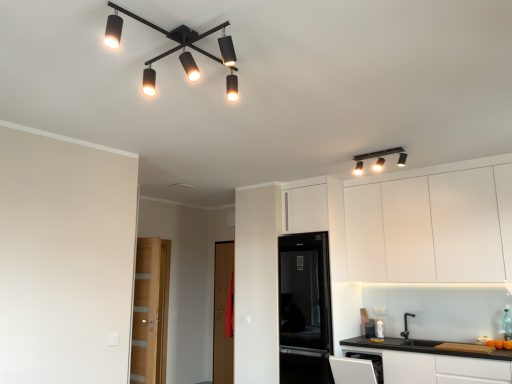
Where is `white matte cabinet at lower right, arranged as the 1th cabinetry when ordered from the bottom`? This screenshot has height=384, width=512. white matte cabinet at lower right, arranged as the 1th cabinetry when ordered from the bottom is located at coordinates (434, 361).

What do you see at coordinates (434, 361) in the screenshot? I see `white matte cabinet at lower right, the 2th cabinetry from the top` at bounding box center [434, 361].

Where is `black glass refrigerator at center`? black glass refrigerator at center is located at coordinates (305, 309).

What do you see at coordinates (182, 46) in the screenshot? I see `matte black light fixture at upper left` at bounding box center [182, 46].

Identify the location of brown wooden door at center. (222, 313).

Does point (225, 246) come closer to viewer compared to point (293, 236)?

No.

From a real-world perspective, is brown wooden door at center above or below black glass refrigerator at center?

In terms of real-world spatial position, brown wooden door at center is below black glass refrigerator at center.

From the image's perspective, which one is positioned lower, brown wooden door at center or black glass refrigerator at center?

brown wooden door at center, from the image's perspective.

Is brown wooden door at center bigger or smaller than black glass refrigerator at center?

In the image, brown wooden door at center appears to be smaller than black glass refrigerator at center.

Considering the relative positions of black glass refrigerator at center and matte black light fixture at upper left in the image provided, is black glass refrigerator at center to the right of matte black light fixture at upper left from the viewer's perspective?

Yes, black glass refrigerator at center is to the right of matte black light fixture at upper left.

Does black glass refrigerator at center have a smaller size compared to matte black light fixture at upper left?

No, black glass refrigerator at center is not smaller than matte black light fixture at upper left.

Does black glass refrigerator at center contain matte black light fixture at upper left?

No.

Based on the photo, is black glass refrigerator at center facing towards matte black light fixture at upper left?

No.

In terms of width, does light brown wooden door at left look wider or thinner when compared to matte black light fixture at upper right?

Considering their sizes, light brown wooden door at left looks broader than matte black light fixture at upper right.

Can matte black light fixture at upper right be found inside light brown wooden door at left?

That's incorrect, matte black light fixture at upper right is not inside light brown wooden door at left.

How distant is light brown wooden door at left from matte black light fixture at upper right?

They are 2.77 meters apart.

Is light brown wooden door at left looking in the opposite direction of matte black light fixture at upper right?

No, light brown wooden door at left's orientation is not away from matte black light fixture at upper right.

Is light brown wooden door at left closer to camera compared to white matte cabinet at upper right, which ranks as the first cabinetry in top-to-bottom order?

No, light brown wooden door at left is behind white matte cabinet at upper right, which ranks as the first cabinetry in top-to-bottom order.

Can you confirm if light brown wooden door at left is bigger than white matte cabinet at upper right, the 2th cabinetry when ordered from bottom to top?

Actually, light brown wooden door at left might be smaller than white matte cabinet at upper right, the 2th cabinetry when ordered from bottom to top.

Is light brown wooden door at left oriented away from white matte cabinet at upper right, which ranks as the first cabinetry in top-to-bottom order?

No, light brown wooden door at left is not facing away from white matte cabinet at upper right, which ranks as the first cabinetry in top-to-bottom order.

Is brown wooden door at center in contact with white matte cabinet at lower right, the 2th cabinetry from the top?

There is a gap between brown wooden door at center and white matte cabinet at lower right, the 2th cabinetry from the top.

Does point (224, 251) appear closer or farther from the camera than point (416, 358)?

Clearly, point (224, 251) is more distant from the camera than point (416, 358).

From a real-world perspective, is brown wooden door at center under white matte cabinet at lower right, arranged as the 1th cabinetry when ordered from the bottom?

No, from a real-world perspective, brown wooden door at center is not below white matte cabinet at lower right, arranged as the 1th cabinetry when ordered from the bottom.

Is point (213, 57) closer or farther from the camera than point (445, 207)?

Clearly, point (213, 57) is closer to the camera than point (445, 207).

Visually, is matte black light fixture at upper left positioned to the left or to the right of white matte cabinet at upper right, the 2th cabinetry when ordered from bottom to top?

matte black light fixture at upper left is positioned on white matte cabinet at upper right, the 2th cabinetry when ordered from bottom to top,'s left side.

Is matte black light fixture at upper left outside of white matte cabinet at upper right, the 2th cabinetry when ordered from bottom to top?

That's correct, matte black light fixture at upper left is outside of white matte cabinet at upper right, the 2th cabinetry when ordered from bottom to top.

Looking at the image, does matte black light fixture at upper left seem bigger or smaller compared to white matte cabinet at upper right, which ranks as the first cabinetry in top-to-bottom order?

In the image, matte black light fixture at upper left appears to be smaller than white matte cabinet at upper right, which ranks as the first cabinetry in top-to-bottom order.

Which object is positioned more to the left, white matte cabinet at upper right, the 2th cabinetry when ordered from bottom to top, or black glass refrigerator at center?

black glass refrigerator at center is more to the left.

Is white matte cabinet at upper right, which ranks as the first cabinetry in top-to-bottom order, oriented towards black glass refrigerator at center?

No, white matte cabinet at upper right, which ranks as the first cabinetry in top-to-bottom order, is not facing towards black glass refrigerator at center.

You are a GUI agent. You are given a task and a screenshot of the screen. Output one action in this format:
    pyautogui.click(x=<x>, y=<y>)
    Task: Click on the cabinetry that is above the black glass refrigerator at center (from a real-world perspective)
    The height and width of the screenshot is (384, 512).
    Given the screenshot: What is the action you would take?
    pyautogui.click(x=432, y=224)

Does white matte cabinet at upper right, which ranks as the first cabinetry in top-to-bottom order, touch black glass refrigerator at center?

No, white matte cabinet at upper right, which ranks as the first cabinetry in top-to-bottom order, is not next to black glass refrigerator at center.

At what (x,y) coordinates should I click in order to perform the action: click on appliance on the right of brown wooden door at center. Please return your answer as a coordinate pair (x, y). This screenshot has width=512, height=384. Looking at the image, I should click on (305, 309).

Locate an element on the screen. The width and height of the screenshot is (512, 384). lamp that is above the black glass refrigerator at center (from the image's perspective) is located at coordinates (182, 46).

When comparing their distances from matte black light fixture at upper right, does brown wooden door at center or white matte cabinet at upper right, which ranks as the first cabinetry in top-to-bottom order, seem further?

The object further to matte black light fixture at upper right is brown wooden door at center.

From the image, which object appears to be nearer to matte black light fixture at upper right, light brown wooden door at left or black glass refrigerator at center?

black glass refrigerator at center is positioned closer to the anchor matte black light fixture at upper right.

Estimate the real-world distances between objects in this image. Which object is further from matte black light fixture at upper left, brown wooden door at center or light brown wooden door at left?

Based on the image, brown wooden door at center appears to be further to matte black light fixture at upper left.

When comparing their distances from white matte cabinet at lower right, arranged as the 1th cabinetry when ordered from the bottom, does matte black light fixture at upper left or black glass refrigerator at center seem further?

Among the two, matte black light fixture at upper left is located further to white matte cabinet at lower right, arranged as the 1th cabinetry when ordered from the bottom.

Considering their positions, is white matte cabinet at upper right, which ranks as the first cabinetry in top-to-bottom order, positioned further to matte black light fixture at upper right than white matte cabinet at lower right, the 2th cabinetry from the top?

The object further to matte black light fixture at upper right is white matte cabinet at lower right, the 2th cabinetry from the top.

Looking at this image, when comparing their distances from matte black light fixture at upper right, does white matte cabinet at lower right, the 2th cabinetry from the top, or matte black light fixture at upper left seem further?

matte black light fixture at upper left lies further to matte black light fixture at upper right than the other object.

When comparing their distances from matte black light fixture at upper right, does black glass refrigerator at center or matte black light fixture at upper left seem closer?

black glass refrigerator at center is closer to matte black light fixture at upper right.

In the scene shown: Looking at the image, which one is located further to matte black light fixture at upper left, black glass refrigerator at center or white matte cabinet at upper right, which ranks as the first cabinetry in top-to-bottom order?

Among the two, black glass refrigerator at center is located further to matte black light fixture at upper left.

This screenshot has width=512, height=384. Find the location of `appliance between white matte cabinet at upper right, the 2th cabinetry when ordered from bottom to top, and white matte cabinet at lower right, the 2th cabinetry from the top, vertically`. appliance between white matte cabinet at upper right, the 2th cabinetry when ordered from bottom to top, and white matte cabinet at lower right, the 2th cabinetry from the top, vertically is located at coordinates (305, 309).

The width and height of the screenshot is (512, 384). In order to click on cabinetry between matte black light fixture at upper right and black glass refrigerator at center vertically in this screenshot , I will do tap(432, 224).

Where is `glass door between light brown wooden door at left and white matte cabinet at upper right, the 2th cabinetry when ordered from bottom to top, in the horizontal direction`? glass door between light brown wooden door at left and white matte cabinet at upper right, the 2th cabinetry when ordered from bottom to top, in the horizontal direction is located at coordinates (222, 313).

Where is `light fixture located between matte black light fixture at upper left and brown wooden door at center in the depth direction`? The width and height of the screenshot is (512, 384). light fixture located between matte black light fixture at upper left and brown wooden door at center in the depth direction is located at coordinates (379, 159).